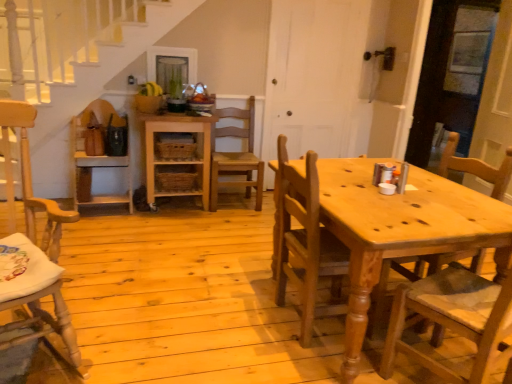
Where is `free space that is in between natural wood chair at center, the 4th chair from the left, and wooden chair at center, which is counted as the 5th chair, starting from the right`? The image size is (512, 384). free space that is in between natural wood chair at center, the 4th chair from the left, and wooden chair at center, which is counted as the 5th chair, starting from the right is located at coordinates (183, 260).